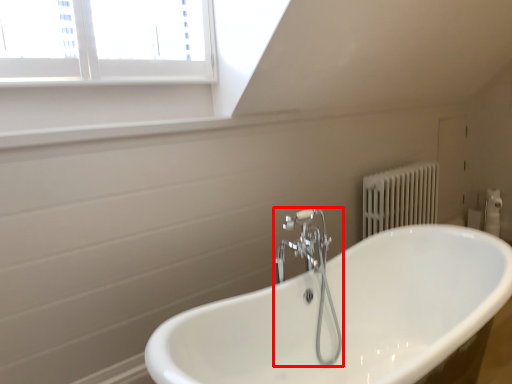
Question: From the image's perspective, where is tap (annotated by the red box) located in relation to bathtub in the image?

Choices:
 (A) above
 (B) below

Answer: (A)